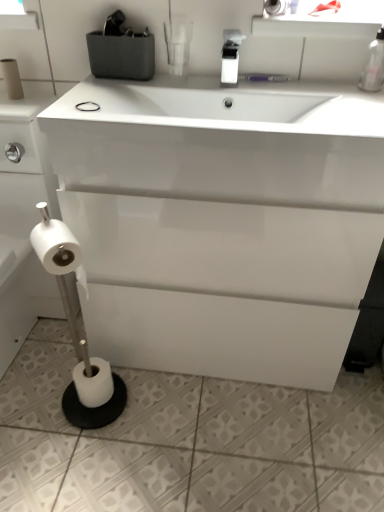
Where is `vacant area located to the right-hand side of white matte toilet paper at lower left, positioned as the first toilet paper in bottom-to-top order`? The height and width of the screenshot is (512, 384). vacant area located to the right-hand side of white matte toilet paper at lower left, positioned as the first toilet paper in bottom-to-top order is located at coordinates (147, 403).